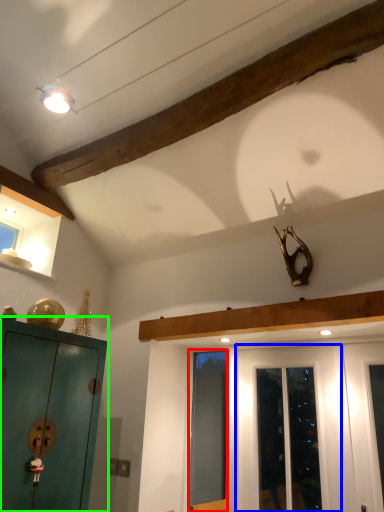
Question: Estimate the real-world distances between objects in this image. Which object is farther from screen door (highlighted by a red box), door (highlighted by a blue box) or cabinetry (highlighted by a green box)?

Choices:
 (A) door
 (B) cabinetry

Answer: (B)